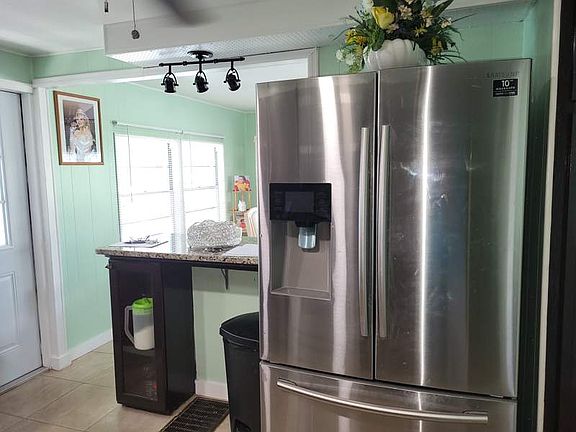
Where is `cabinet`? The width and height of the screenshot is (576, 432). cabinet is located at coordinates (161, 305).